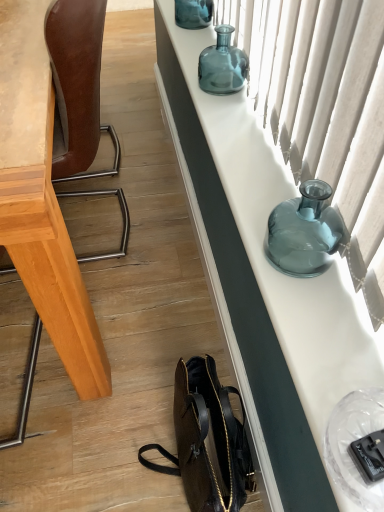
This screenshot has height=512, width=384. I want to click on vacant space in between translucent glass vase at upper center, the second bottle when ordered from bottom to top, and translucent fabric curtain at upper right, so click(x=244, y=115).